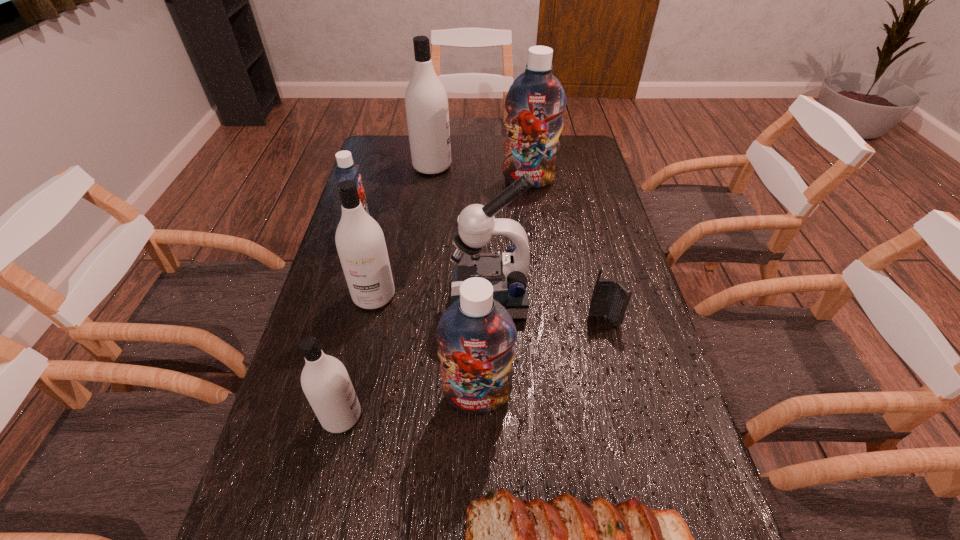
The width and height of the screenshot is (960, 540). Find the location of `shampoo that is the nearest to the second smallest white shampoo`. shampoo that is the nearest to the second smallest white shampoo is located at coordinates (346, 169).

Locate an element on the screen. This screenshot has height=540, width=960. shampoo that is the third closest to the cellular telephone is located at coordinates (535, 102).

Point out which white shampoo is positioned as the nearest to the gray microscope. Please provide its 2D coordinates. Your answer should be formatted as a tuple, i.e. [(x, y)], where the tuple contains the x and y coordinates of a point satisfying the conditions above.

[(360, 242)]

Identify which white shampoo is the second nearest to the second biggest white shampoo. Please provide its 2D coordinates. Your answer should be formatted as a tuple, i.e. [(x, y)], where the tuple contains the x and y coordinates of a point satisfying the conditions above.

[(426, 101)]

Locate an element on the screen. Image resolution: width=960 pixels, height=540 pixels. blue shampoo that is the third closest one to the farthest white shampoo is located at coordinates (476, 335).

Choose which blue shampoo is the third nearest neighbor to the nearest white shampoo. Please provide its 2D coordinates. Your answer should be formatted as a tuple, i.e. [(x, y)], where the tuple contains the x and y coordinates of a point satisfying the conditions above.

[(535, 102)]

Image resolution: width=960 pixels, height=540 pixels. I want to click on vacant space that satisfies the following two spatial constraints: 1. on the front label of the biggest blue shampoo; 2. on the front label of the smallest blue shampoo, so click(536, 230).

Where is `free region that satisfies the following two spatial constraints: 1. on the front label of the biggest blue shampoo; 2. on the front-facing side of the smallest white shampoo`? The height and width of the screenshot is (540, 960). free region that satisfies the following two spatial constraints: 1. on the front label of the biggest blue shampoo; 2. on the front-facing side of the smallest white shampoo is located at coordinates (561, 416).

Identify the location of free point that satisfies the following two spatial constraints: 1. on the front-facing side of the farthest white shampoo; 2. on the right side of the gray microscope. The width and height of the screenshot is (960, 540). (414, 298).

Where is `free space that satisfies the following two spatial constraints: 1. on the front side of the gray microscope; 2. on the front-facing side of the nearest white shampoo`? This screenshot has height=540, width=960. free space that satisfies the following two spatial constraints: 1. on the front side of the gray microscope; 2. on the front-facing side of the nearest white shampoo is located at coordinates click(x=492, y=416).